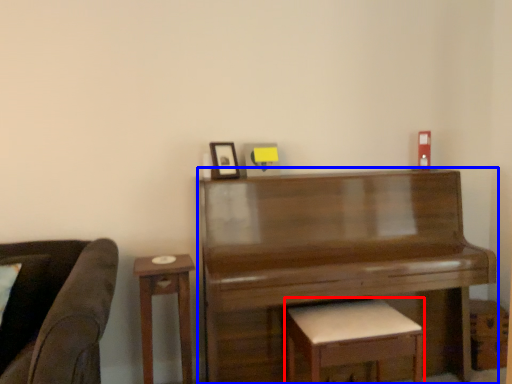
Question: Which object is closer to the camera taking this photo, stool (highlighted by a red box) or piano (highlighted by a blue box)?

Choices:
 (A) stool
 (B) piano

Answer: (A)